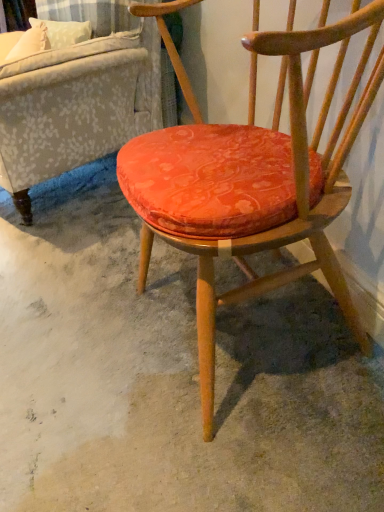
Locate an element on the screen. velvet orange cushion at center is located at coordinates (251, 175).

This screenshot has height=512, width=384. I want to click on textured gray fabric couch at upper left, so click(x=77, y=96).

Is textured gray fabric couch at upper left bigger than orange fabric cushion at center?

Correct, textured gray fabric couch at upper left is larger in size than orange fabric cushion at center.

Can you confirm if textured gray fabric couch at upper left is taller than orange fabric cushion at center?

Correct, textured gray fabric couch at upper left is much taller as orange fabric cushion at center.

Is textured gray fabric couch at upper left completely or partially outside of orange fabric cushion at center?

Yes, textured gray fabric couch at upper left is not within orange fabric cushion at center.

Would you say textured gray fabric couch at upper left is to the left or to the right of orange fabric cushion at center in the picture?

textured gray fabric couch at upper left is to the left of orange fabric cushion at center.

From a real-world perspective, is textured gray fabric couch at upper left physically above velvet orange cushion at center?

Actually, textured gray fabric couch at upper left is physically below velvet orange cushion at center in the real world.

Where is `studio couch below the velvet orange cushion at center (from a real-world perspective)`? The width and height of the screenshot is (384, 512). studio couch below the velvet orange cushion at center (from a real-world perspective) is located at coordinates (77, 96).

How far apart are textured gray fabric couch at upper left and velvet orange cushion at center?

textured gray fabric couch at upper left is 29.74 inches away from velvet orange cushion at center.

Is textured gray fabric couch at upper left positioned far away from velvet orange cushion at center?

textured gray fabric couch at upper left is near velvet orange cushion at center, not far away.

Is point (356, 320) closer or farther from the camera than point (253, 323)?

Point (356, 320).

Considering the relative positions of velvet orange cushion at center and orange fabric cushion at center in the image provided, is velvet orange cushion at center to the right of orange fabric cushion at center from the viewer's perspective?

Yes, velvet orange cushion at center is to the right of orange fabric cushion at center.

Would you say velvet orange cushion at center contains orange fabric cushion at center?

Actually, orange fabric cushion at center is outside velvet orange cushion at center.

From the image's perspective, is velvet orange cushion at center located above or below orange fabric cushion at center?

Based on their image positions, velvet orange cushion at center is located above orange fabric cushion at center.

Does orange fabric cushion at center touch velvet orange cushion at center?

No, orange fabric cushion at center is not making contact with velvet orange cushion at center.

Which of these two, orange fabric cushion at center or velvet orange cushion at center, stands taller?

Standing taller between the two is velvet orange cushion at center.

From the image's perspective, is orange fabric cushion at center located beneath velvet orange cushion at center?

Yes, from the image's perspective, orange fabric cushion at center is beneath velvet orange cushion at center.

Considering the points (90, 310) and (124, 44), which point is behind, point (90, 310) or point (124, 44)?

Positioned behind is point (124, 44).

Between orange fabric cushion at center and textured gray fabric couch at upper left, which one has smaller width?

orange fabric cushion at center is thinner.

Is orange fabric cushion at center beside textured gray fabric couch at upper left?

orange fabric cushion at center and textured gray fabric couch at upper left are clearly separated.

Who is taller, orange fabric cushion at center or textured gray fabric couch at upper left?

textured gray fabric couch at upper left.

Considering the sizes of objects velvet orange cushion at center and textured gray fabric couch at upper left in the image provided, who is shorter, velvet orange cushion at center or textured gray fabric couch at upper left?

Standing shorter between the two is textured gray fabric couch at upper left.

Which is in front, velvet orange cushion at center or textured gray fabric couch at upper left?

velvet orange cushion at center.

Which is less distant, (208, 371) or (15, 167)?

The point (208, 371) is in front.

From the image's perspective, between velvet orange cushion at center and textured gray fabric couch at upper left, who is located below?

velvet orange cushion at center is shown below in the image.

At what (x,y) coordinates should I click in order to perform the action: click on concrete that is under the textured gray fabric couch at upper left (from a real-world perspective). Please return your answer as a coordinate pair (x, y). The image size is (384, 512). Looking at the image, I should click on (168, 376).

I want to click on studio couch located on the left of velvet orange cushion at center, so click(x=77, y=96).

When comparing their distances from orange fabric cushion at center, does textured gray fabric couch at upper left or velvet orange cushion at center seem closer?

velvet orange cushion at center is positioned closer to the anchor orange fabric cushion at center.

Looking at the image, which one is located closer to textured gray fabric couch at upper left, velvet orange cushion at center or orange fabric cushion at center?

orange fabric cushion at center is positioned closer to the anchor textured gray fabric couch at upper left.

From the image, which object appears to be farther from velvet orange cushion at center, orange fabric cushion at center or textured gray fabric couch at upper left?

textured gray fabric couch at upper left lies further to velvet orange cushion at center than the other object.

Considering their positions, is orange fabric cushion at center positioned further to textured gray fabric couch at upper left than velvet orange cushion at center?

The object further to textured gray fabric couch at upper left is velvet orange cushion at center.

Which object lies nearer to the anchor point velvet orange cushion at center, textured gray fabric couch at upper left or orange fabric cushion at center?

Among the two, orange fabric cushion at center is located nearer to velvet orange cushion at center.

Based on their spatial positions, is velvet orange cushion at center or textured gray fabric couch at upper left further from orange fabric cushion at center?

textured gray fabric couch at upper left is positioned further to the anchor orange fabric cushion at center.

Where is `chair between textured gray fabric couch at upper left and orange fabric cushion at center vertically`? This screenshot has width=384, height=512. chair between textured gray fabric couch at upper left and orange fabric cushion at center vertically is located at coordinates [x=251, y=175].